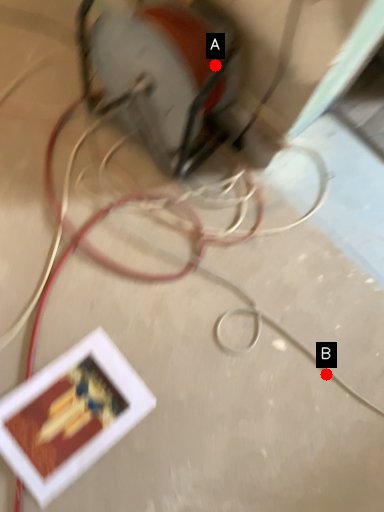
Question: Two points are circled on the image, labeled by A and B beside each circle. Which point is further to the camera?

Choices:
 (A) A is further
 (B) B is further

Answer: (B)